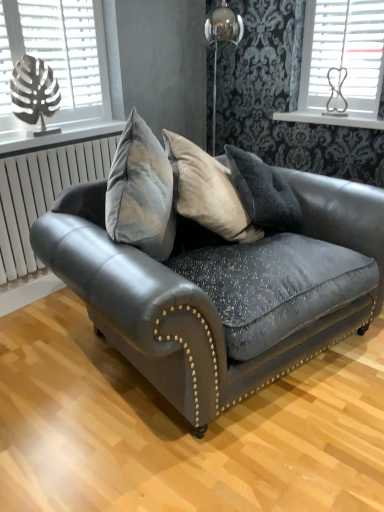
Where is `vacant space situated above white metallic radiator at left (from a real-world perspective)`? Image resolution: width=384 pixels, height=512 pixels. vacant space situated above white metallic radiator at left (from a real-world perspective) is located at coordinates (66, 145).